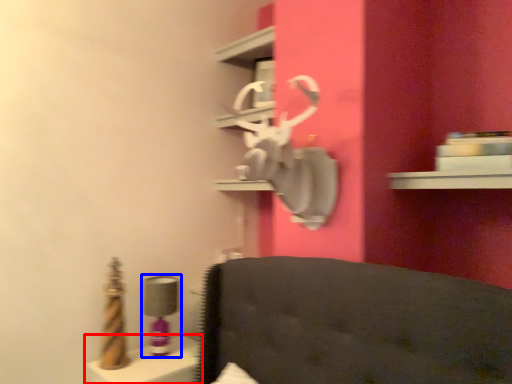
Question: Among these objects, which one is nearest to the camera, vanity (highlighted by a red box) or table lamp (highlighted by a blue box)?

Choices:
 (A) vanity
 (B) table lamp

Answer: (A)